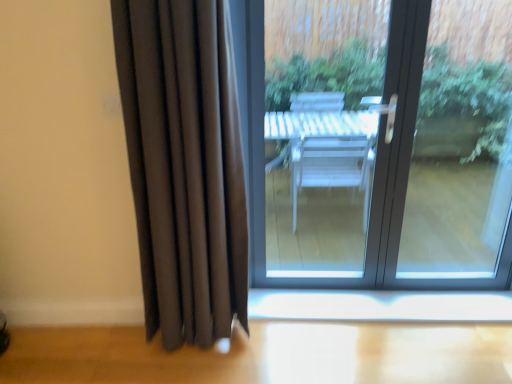
This screenshot has width=512, height=384. I want to click on free spot in front of matte black curtain at left, so click(x=178, y=369).